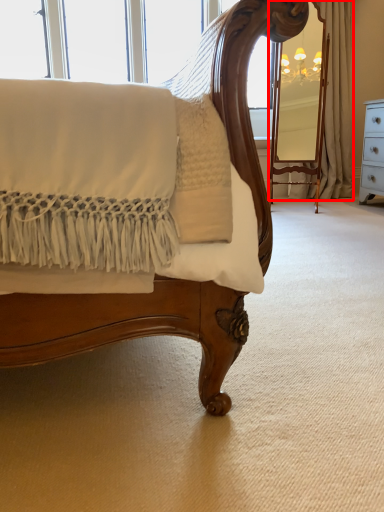
Question: From the image's perspective, what is the correct spatial positioning of curtain (annotated by the red box) in reference to curtain?

Choices:
 (A) below
 (B) above

Answer: (A)